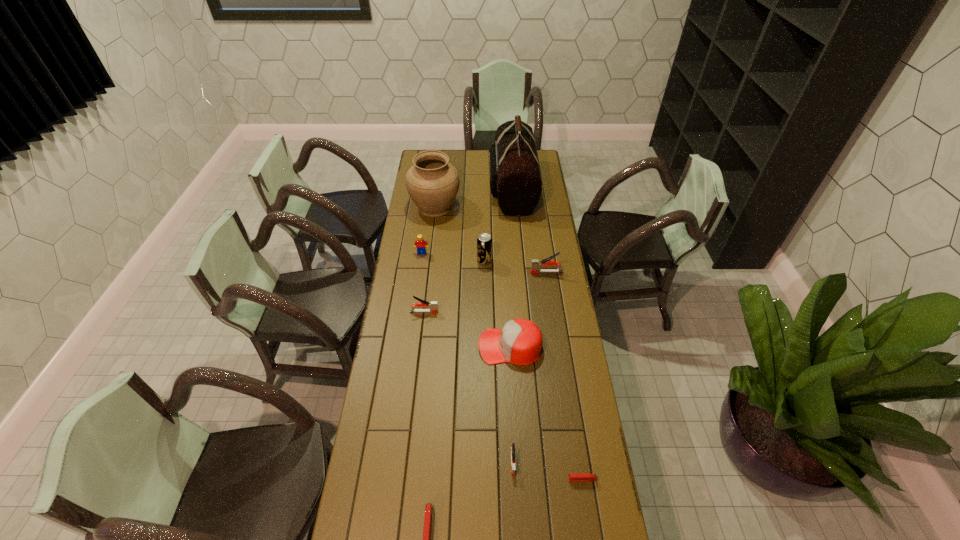
You are a GUI agent. You are given a task and a screenshot of the screen. Output one action in this format:
    pyautogui.click(x=<x>, y=<y>)
    Task: Click on the red duffel bag
    This screenshot has width=960, height=540.
    Given the screenshot: What is the action you would take?
    pyautogui.click(x=515, y=180)

Where is `duffel bag`? duffel bag is located at coordinates (515, 180).

Image resolution: width=960 pixels, height=540 pixels. In order to click on urn in this screenshot , I will do `click(432, 182)`.

Locate an element on the screen. This screenshot has width=960, height=540. soda can is located at coordinates point(484,242).

Find the location of `the eighth shortest object`. the eighth shortest object is located at coordinates coord(484,242).

Locate an element on the screen. The width and height of the screenshot is (960, 540). the rightmost gray stapler is located at coordinates coord(536,264).

Identify the location of the sixth nearest object. This screenshot has width=960, height=540. (536, 264).

Where is `Lego`? The image size is (960, 540). Lego is located at coordinates (420, 242).

Image resolution: width=960 pixels, height=540 pixels. In order to click on the third farthest object in this screenshot , I will do `click(420, 242)`.

Where is `the seventh farthest object`? Image resolution: width=960 pixels, height=540 pixels. the seventh farthest object is located at coordinates (520, 341).